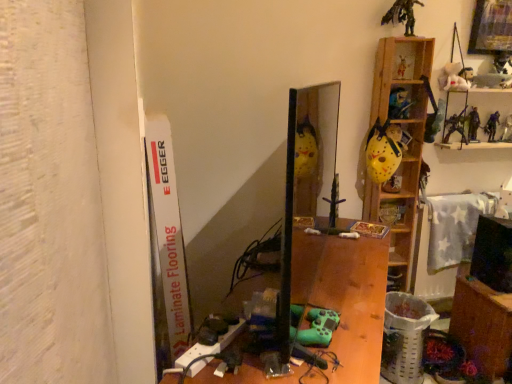
Question: Considering the positions of point (420, 142) and point (397, 139), is point (420, 142) closer or farther from the camera than point (397, 139)?

Choices:
 (A) closer
 (B) farther

Answer: (A)

Question: Based on their sizes in the image, would you say wooden at right, acting as the third shelf starting from the top, is bigger or smaller than yellow matte helmet at upper right, positioned as the second shelf in bottom-to-top order?

Choices:
 (A) small
 (B) big

Answer: (B)

Question: Which object is positioned closest to the white laminate flooring at left?

Choices:
 (A) wooden desk at center
 (B) wooden shelf at upper right, the first shelf in the top-to-bottom sequence
 (C) yellow matte helmet at upper right, positioned as the second shelf in bottom-to-top order
 (D) wooden at right, marked as the first shelf in a bottom-to-top arrangement
 (E) wooden table at lower right

Answer: (A)

Question: Estimate the real-world distances between objects in this image. Which object is farther from the wooden table at lower right?

Choices:
 (A) wooden at right, marked as the first shelf in a bottom-to-top arrangement
 (B) white laminate flooring at left
 (C) wooden desk at center
 (D) yellow matte helmet at upper right, which is the second shelf in top-to-bottom order
 (E) wooden shelf at upper right, the third shelf in the bottom-to-top sequence

Answer: (B)